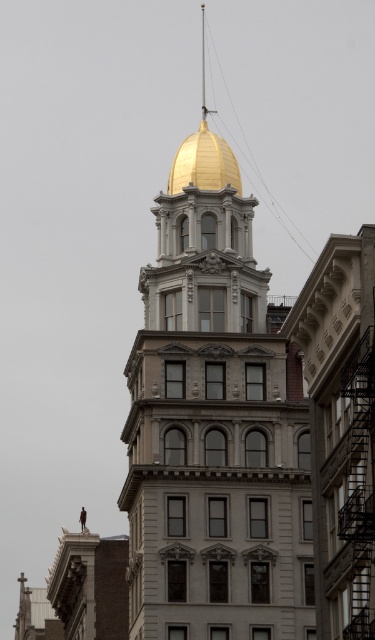
Question: Which object appears closest to the camera in this image?

Choices:
 (A) gold polished dome at top
 (B) gold polished dome at center

Answer: (B)

Question: In this image, where is gold polished dome at center located relative to gold polished dome at top?

Choices:
 (A) below
 (B) above

Answer: (B)

Question: Does gold polished dome at center appear under gold polished dome at top?

Choices:
 (A) yes
 (B) no

Answer: (B)

Question: Can you confirm if gold polished dome at center is smaller than gold polished dome at top?

Choices:
 (A) yes
 (B) no

Answer: (B)

Question: Which of the following is the closest to the observer?

Choices:
 (A) gold polished dome at top
 (B) gold polished dome at center

Answer: (B)